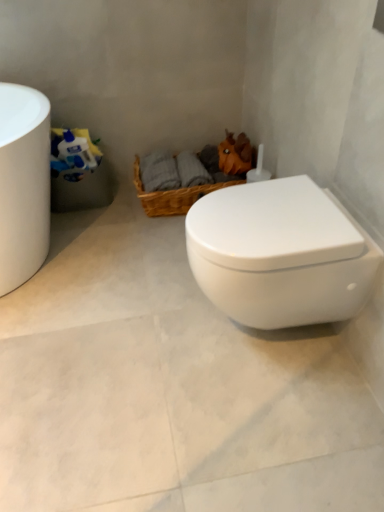
The width and height of the screenshot is (384, 512). In order to click on empty space that is ontop of white glossy toilet at center (from a real-world perspective) in this screenshot , I will do `click(148, 322)`.